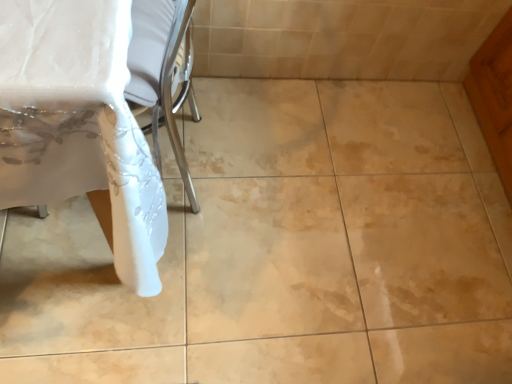
Identify the location of vacant area located to the right-hand side of white fabric tablecloth at left. Image resolution: width=512 pixels, height=384 pixels. (285, 210).